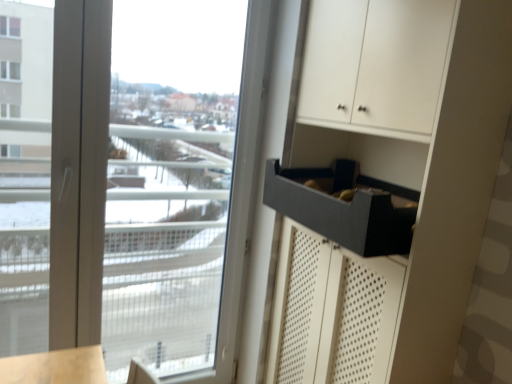
This screenshot has width=512, height=384. Describe the element at coordinates (133, 187) in the screenshot. I see `transparent glass window at upper left` at that location.

Describe the element at coordinates (341, 215) in the screenshot. I see `matte gray drawer at lower right` at that location.

Describe the element at coordinates (387, 187) in the screenshot. This screenshot has width=512, height=384. I see `matte black drawer at right` at that location.

What are the coordinates of `matte black drawer at right` in the screenshot? It's located at (387, 187).

You are a GUI agent. You are given a task and a screenshot of the screen. Output one action in this format:
    pyautogui.click(x=<x>, y=<y>)
    Task: Click on the transparent glass window at upper left
    This screenshot has width=512, height=384.
    Given the screenshot: What is the action you would take?
    pyautogui.click(x=133, y=187)

In the scene shown: Can you confirm if transparent glass window at upper left is wider than matte gray drawer at lower right?

Incorrect, the width of transparent glass window at upper left does not surpass that of matte gray drawer at lower right.

Are transparent glass window at upper left and matte gray drawer at lower right far apart?

transparent glass window at upper left is positioned a significant distance from matte gray drawer at lower right.

Is transparent glass window at upper left not inside matte gray drawer at lower right?

Yes, transparent glass window at upper left is outside of matte gray drawer at lower right.

Is transparent glass window at upper left smaller than matte gray drawer at lower right?

Incorrect, transparent glass window at upper left is not smaller in size than matte gray drawer at lower right.

Could you tell me if matte gray drawer at lower right is facing matte black drawer at right?

Yes, matte gray drawer at lower right is aimed at matte black drawer at right.

From the image's perspective, is matte gray drawer at lower right located above or below matte black drawer at right?

matte gray drawer at lower right is situated higher than matte black drawer at right in the image.

Which is in front, matte gray drawer at lower right or matte black drawer at right?

matte black drawer at right.

How far apart are matte gray drawer at lower right and matte black drawer at right?

Result: matte gray drawer at lower right and matte black drawer at right are 9.09 inches apart from each other.

Is matte black drawer at right not inside transparent glass window at upper left?

Yes, matte black drawer at right is outside of transparent glass window at upper left.

Is matte black drawer at right aimed at transparent glass window at upper left?

No, matte black drawer at right is not oriented towards transparent glass window at upper left.

How much distance is there between matte black drawer at right and transparent glass window at upper left?

matte black drawer at right is 32.96 inches away from transparent glass window at upper left.

Can you confirm if matte black drawer at right is positioned to the left of transparent glass window at upper left?

Incorrect, matte black drawer at right is not on the left side of transparent glass window at upper left.

Which of these two, transparent glass window at upper left or matte black drawer at right, is wider?

Wider between the two is matte black drawer at right.

Is transparent glass window at upper left next to matte black drawer at right and touching it?

They are not placed beside each other.

Considering the sizes of objects transparent glass window at upper left and matte black drawer at right in the image provided, who is taller, transparent glass window at upper left or matte black drawer at right?

With more height is transparent glass window at upper left.

Which object is closer to the camera taking this photo, transparent glass window at upper left or matte black drawer at right?

matte black drawer at right.

In order to click on drawer lying above the matte black drawer at right (from the image's perspective) in this screenshot , I will do `click(341, 215)`.

Are matte black drawer at right and matte gray drawer at lower right beside each other?

There is a gap between matte black drawer at right and matte gray drawer at lower right.

In the scene shown: Can you confirm if matte black drawer at right is positioned to the right of matte gray drawer at lower right?

Yes, matte black drawer at right is to the right of matte gray drawer at lower right.

What's the angular difference between matte black drawer at right and matte gray drawer at lower right's facing directions?

The angle between the facing direction of matte black drawer at right and the facing direction of matte gray drawer at lower right is 0.351 degrees.

Consider the image. Is matte gray drawer at lower right next to transparent glass window at upper left and touching it?

No.

From the image's perspective, which object appears higher, matte gray drawer at lower right or transparent glass window at upper left?

matte gray drawer at lower right, from the image's perspective.

What's the angular difference between matte gray drawer at lower right and transparent glass window at upper left's facing directions?

The facing directions of matte gray drawer at lower right and transparent glass window at upper left are 89.7 degrees apart.

Image resolution: width=512 pixels, height=384 pixels. I want to click on drawer on the right of transparent glass window at upper left, so click(341, 215).

The image size is (512, 384). What are the coordinates of `dresser in front of the matte gray drawer at lower right` in the screenshot? It's located at (387, 187).

Estimate the real-world distances between objects in this image. Which object is closer to transparent glass window at upper left, matte gray drawer at lower right or matte black drawer at right?

The object closer to transparent glass window at upper left is matte black drawer at right.

Based on their spatial positions, is transparent glass window at upper left or matte black drawer at right further from matte gray drawer at lower right?

The object further to matte gray drawer at lower right is transparent glass window at upper left.

From the image, which object appears to be farther from matte black drawer at right, matte gray drawer at lower right or transparent glass window at upper left?

The object further to matte black drawer at right is transparent glass window at upper left.

From the image, which object appears to be nearer to matte gray drawer at lower right, matte black drawer at right or transparent glass window at upper left?

matte black drawer at right is closer to matte gray drawer at lower right.

When comparing their distances from matte black drawer at right, does transparent glass window at upper left or matte gray drawer at lower right seem further?

transparent glass window at upper left.

Estimate the real-world distances between objects in this image. Which object is closer to transparent glass window at upper left, matte black drawer at right or matte gray drawer at lower right?

Among the two, matte black drawer at right is located nearer to transparent glass window at upper left.

Where is `drawer located between transparent glass window at upper left and matte black drawer at right in the left-right direction`? The image size is (512, 384). drawer located between transparent glass window at upper left and matte black drawer at right in the left-right direction is located at coordinates (341, 215).